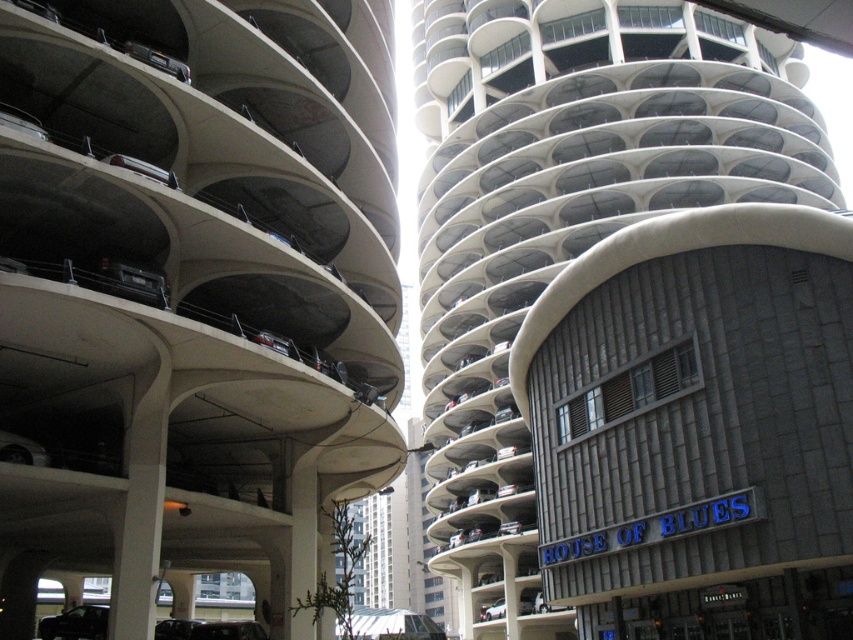
Question: Which point is farther to the camera?

Choices:
 (A) black glossy car at lower center
 (B) matte black car at lower left

Answer: (A)

Question: Is shiny black suv at lower left positioned in front of matte black car at lower left?

Choices:
 (A) yes
 (B) no

Answer: (B)

Question: Is shiny black suv at lower left further to the viewer compared to black glossy car at lower center?

Choices:
 (A) yes
 (B) no

Answer: (A)

Question: Which point is farther to the camera?

Choices:
 (A) (254, 628)
 (B) (55, 618)
 (C) (161, 630)

Answer: (B)

Question: Which object appears farthest from the camera in this image?

Choices:
 (A) shiny black suv at lower left
 (B) black glossy car at lower center

Answer: (A)

Question: Considering the relative positions of black glossy car at lower center and matte black car at lower left in the image provided, where is black glossy car at lower center located with respect to matte black car at lower left?

Choices:
 (A) below
 (B) above

Answer: (A)